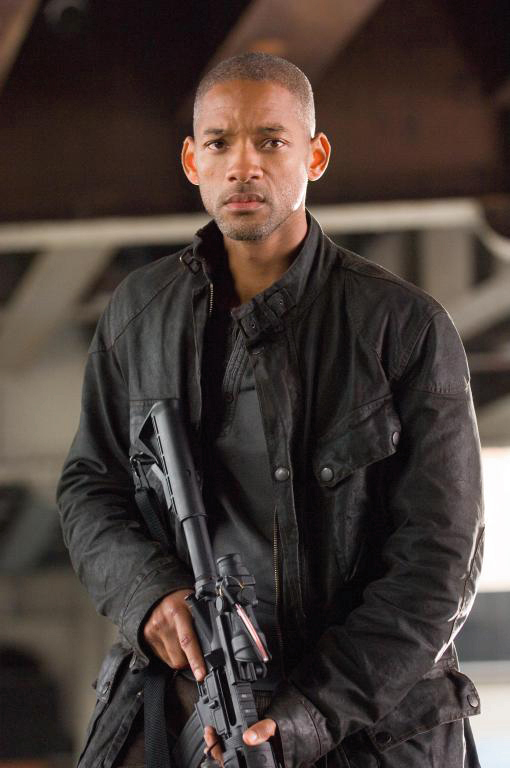
This screenshot has height=768, width=510. Find the location of `magazine`. magazine is located at coordinates (185, 737).